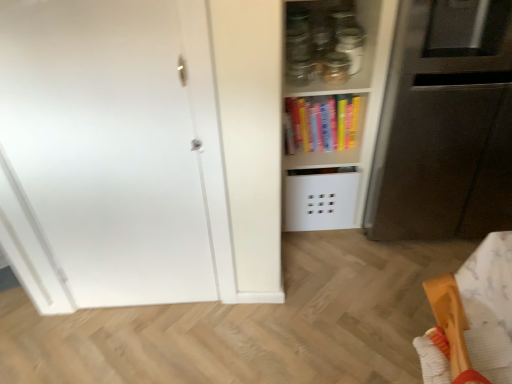
Question: Does white matte door at left have a greater height compared to wooden spatula at lower right?

Choices:
 (A) no
 (B) yes

Answer: (B)

Question: Is white matte door at left closer to camera compared to wooden spatula at lower right?

Choices:
 (A) yes
 (B) no

Answer: (B)

Question: Is the surface of white matte door at left in direct contact with wooden spatula at lower right?

Choices:
 (A) yes
 (B) no

Answer: (B)

Question: Is white matte door at left facing away from wooden spatula at lower right?

Choices:
 (A) no
 (B) yes

Answer: (A)

Question: Considering the relative sizes of white matte door at left and wooden spatula at lower right in the image provided, is white matte door at left wider than wooden spatula at lower right?

Choices:
 (A) yes
 (B) no

Answer: (B)

Question: From a real-world perspective, is white matte door at left under wooden spatula at lower right?

Choices:
 (A) yes
 (B) no

Answer: (A)

Question: Is white matte door at left behind matt black microwave at right?

Choices:
 (A) yes
 (B) no

Answer: (B)

Question: Is white matte door at left not close to matt black microwave at right?

Choices:
 (A) yes
 (B) no

Answer: (B)

Question: Is matt black microwave at right completely or partially inside white matte door at left?

Choices:
 (A) yes
 (B) no

Answer: (B)

Question: From a real-world perspective, does white matte door at left stand above matt black microwave at right?

Choices:
 (A) yes
 (B) no

Answer: (A)

Question: Does white matte door at left have a greater width compared to matt black microwave at right?

Choices:
 (A) yes
 (B) no

Answer: (B)

Question: From the image's perspective, is white matte door at left on top of matt black microwave at right?

Choices:
 (A) no
 (B) yes

Answer: (A)

Question: Is wooden spatula at lower right in contact with matt black microwave at right?

Choices:
 (A) no
 (B) yes

Answer: (A)